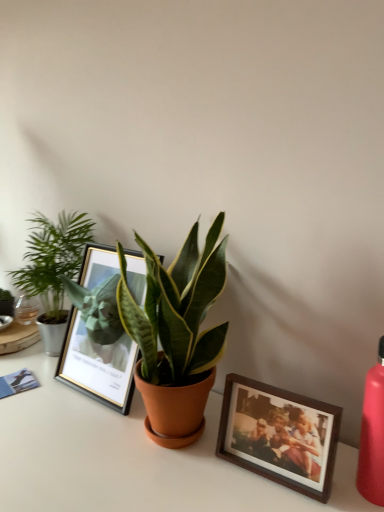
This screenshot has width=384, height=512. What are the coordinates of `free space to the left of green glossy houseplant at center, which is the 1th houseplant from front to back` in the screenshot? It's located at (58, 435).